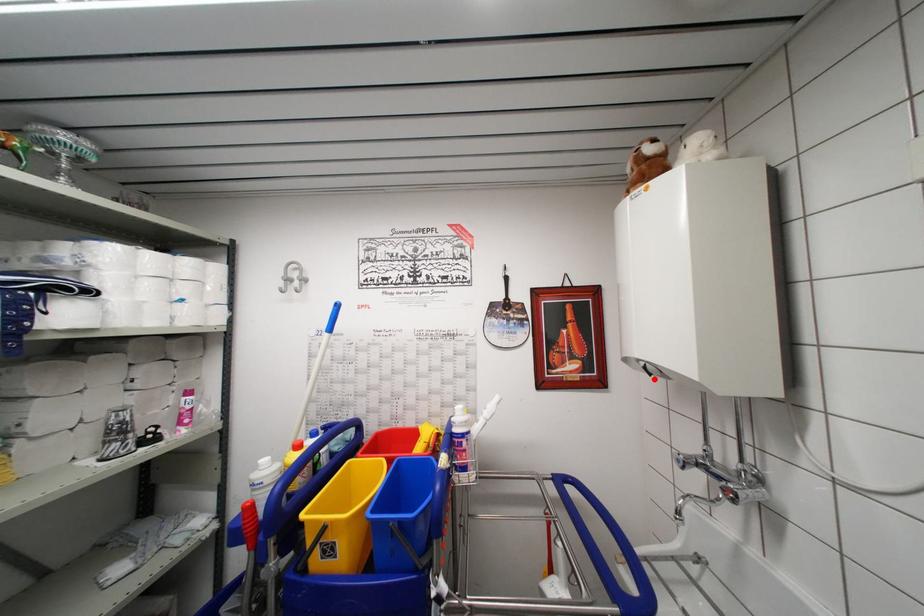
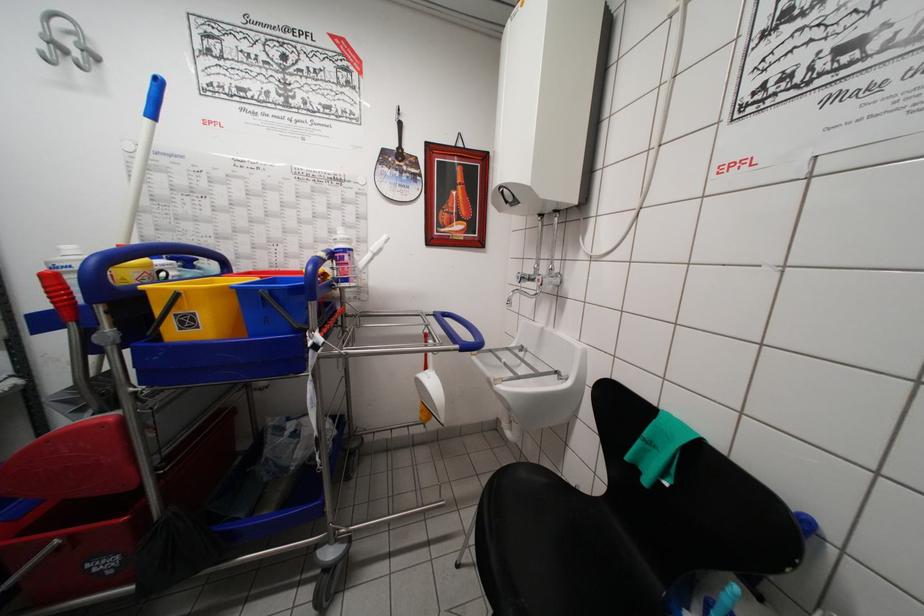
Locate, in the second image, the point that corresponds to the highlighted location in the first image.

(511, 207)